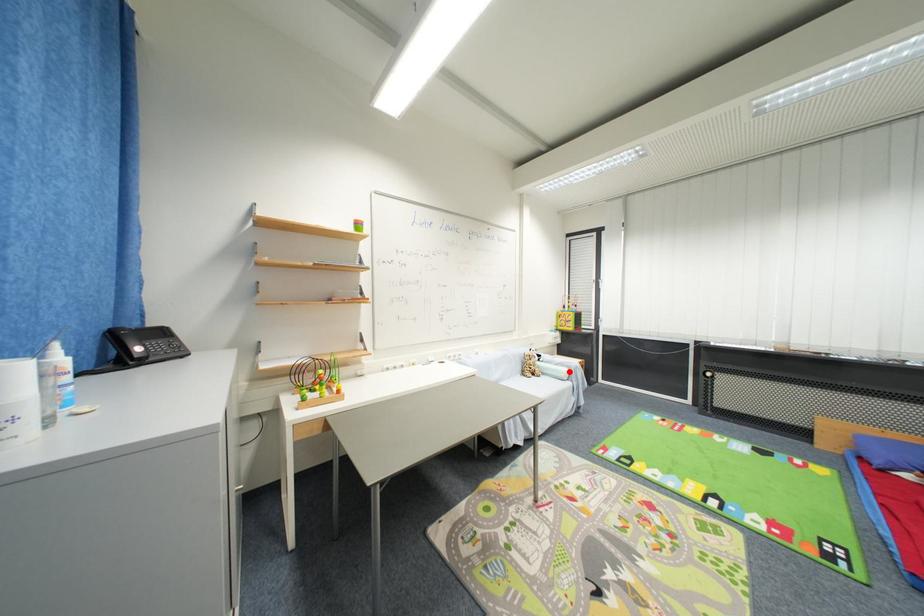
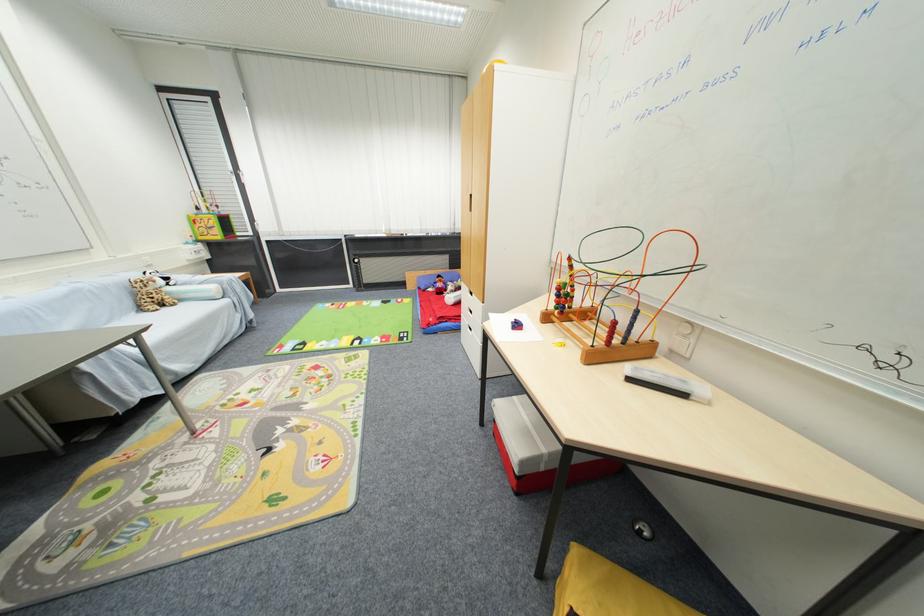
The point at the highlighted location is marked in the first image. Where is the corresponding point in the second image?

(217, 290)